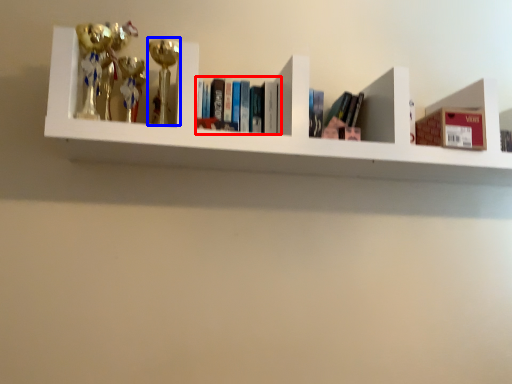
Question: Which point is further to the camera, book (highlighted by a red box) or toy (highlighted by a blue box)?

Choices:
 (A) book
 (B) toy

Answer: (A)